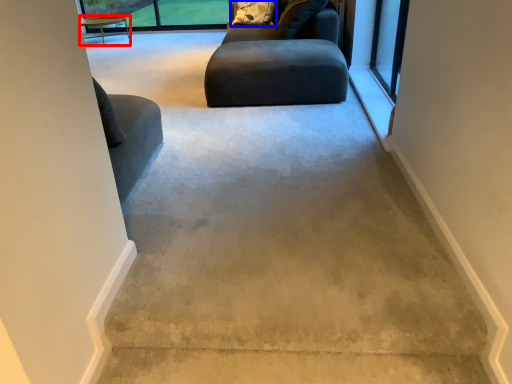
Question: Which object is closer to the camera taking this photo, table (highlighted by a red box) or pillow (highlighted by a blue box)?

Choices:
 (A) table
 (B) pillow

Answer: (B)